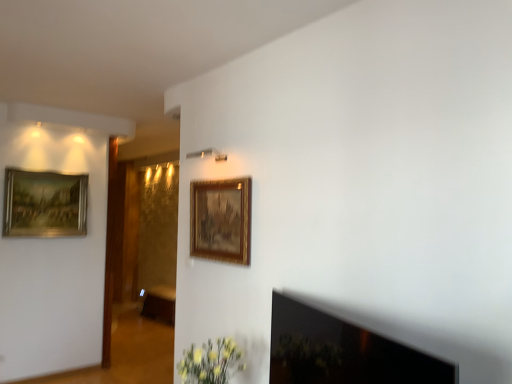
The image size is (512, 384). What do you see at coordinates (160, 304) in the screenshot? I see `brown wood cabinet at center` at bounding box center [160, 304].

I want to click on black glass fireplace at lower right, so click(343, 352).

The height and width of the screenshot is (384, 512). What do you see at coordinates (44, 204) in the screenshot?
I see `gold-framed painting at upper left, the second picture frame viewed from the front` at bounding box center [44, 204].

This screenshot has width=512, height=384. I want to click on brown wood cabinet at center, so click(160, 304).

Can you confirm if gold-framed painting at upper left, the 2th picture frame viewed from the right, is smaller than brown wood cabinet at center?

Indeed, gold-framed painting at upper left, the 2th picture frame viewed from the right, has a smaller size compared to brown wood cabinet at center.

In the scene shown: In the image, is gold-framed painting at upper left, the second picture frame viewed from the front, positioned in front of or behind brown wood cabinet at center?

gold-framed painting at upper left, the second picture frame viewed from the front, is positioned closer to the viewer than brown wood cabinet at center.

From a real-world perspective, which is physically below, gold-framed painting at upper left, which ranks as the first picture frame in back-to-front order, or brown wood cabinet at center?

From a 3D spatial view, brown wood cabinet at center is below.

Is gold-framed painting at upper left, which ranks as the first picture frame in back-to-front order, touching brown wood cabinet at center?

No, gold-framed painting at upper left, which ranks as the first picture frame in back-to-front order, is not with brown wood cabinet at center.

Locate an element on the screen. the 1st picture frame located above the black glass fireplace at lower right (from a real-world perspective) is located at coordinates (221, 220).

Is black glass fireplace at lower right turned away from gold/gilded picture frame at upper center, the second picture frame in the left-to-right sequence?

No, gold/gilded picture frame at upper center, the second picture frame in the left-to-right sequence, is not at the back of black glass fireplace at lower right.

Which is farther from the camera, (272, 343) or (219, 254)?

Point (219, 254)

In the image, is black glass fireplace at lower right positioned in front of or behind gold/gilded picture frame at upper center, which appears as the first picture frame when viewed from the right?

black glass fireplace at lower right is in front of gold/gilded picture frame at upper center, which appears as the first picture frame when viewed from the right.

From a real-world perspective, which object rests below the other?

From a 3D spatial view, brown wood cabinet at center is below.

Looking at this image, which is behind, gold/gilded picture frame at upper center, the 2th picture frame from the back, or brown wood cabinet at center?

brown wood cabinet at center is more distant.

Which object is further away from the camera, black glass fireplace at lower right or gold-framed painting at upper left, which ranks as the first picture frame in back-to-front order?

gold-framed painting at upper left, which ranks as the first picture frame in back-to-front order, is further from the camera.

Is black glass fireplace at lower right in contact with gold-framed painting at upper left, which is the 1th picture frame in left-to-right order?

black glass fireplace at lower right and gold-framed painting at upper left, which is the 1th picture frame in left-to-right order, are not in contact.

In terms of height, does black glass fireplace at lower right look taller or shorter compared to gold-framed painting at upper left, which is the 1th picture frame in left-to-right order?

In the image, black glass fireplace at lower right appears to be shorter than gold-framed painting at upper left, which is the 1th picture frame in left-to-right order.

Does point (371, 381) appear closer or farther from the camera than point (34, 199)?

Clearly, point (371, 381) is closer to the camera than point (34, 199).

How many degrees apart are the facing directions of black glass fireplace at lower right and brown wood cabinet at center?

18.9 degrees.

Which is in front, black glass fireplace at lower right or brown wood cabinet at center?

black glass fireplace at lower right is closer to the camera.

From the image's perspective, is black glass fireplace at lower right located beneath brown wood cabinet at center?

No, from the image's perspective, black glass fireplace at lower right is not beneath brown wood cabinet at center.

Is black glass fireplace at lower right next to brown wood cabinet at center?

No, black glass fireplace at lower right is not making contact with brown wood cabinet at center.

Which is more to the left, brown wood cabinet at center or black glass fireplace at lower right?

Positioned to the left is brown wood cabinet at center.

From the image's perspective, which is below, brown wood cabinet at center or black glass fireplace at lower right?

From the image's view, brown wood cabinet at center is below.

From a real-world perspective, which object stands above the other?

black glass fireplace at lower right is physically above.

From the image's perspective, which one is positioned lower, brown wood cabinet at center or gold-framed painting at upper left, which is the 1th picture frame in left-to-right order?

From the image's view, brown wood cabinet at center is below.

Is brown wood cabinet at center to the left or to the right of gold-framed painting at upper left, which is the 1th picture frame in left-to-right order, in the image?

In the image, brown wood cabinet at center appears on the right side of gold-framed painting at upper left, which is the 1th picture frame in left-to-right order.

From a real-world perspective, is brown wood cabinet at center positioned above or below gold-framed painting at upper left, the 2th picture frame viewed from the right?

In terms of real-world spatial position, brown wood cabinet at center is below gold-framed painting at upper left, the 2th picture frame viewed from the right.

At what (x,y) coordinates should I click in order to perform the action: click on furniture that appears below the gold-framed painting at upper left, which is the 1th picture frame in left-to-right order (from a real-world perspective). Please return your answer as a coordinate pair (x, y). This screenshot has width=512, height=384. Looking at the image, I should click on (160, 304).

The width and height of the screenshot is (512, 384). I want to click on fireplace on the right of the gold/gilded picture frame at upper center, placed as the first picture frame when sorted from front to back, so click(x=343, y=352).

Which object lies further to the anchor point gold/gilded picture frame at upper center, the second picture frame in the left-to-right sequence, brown wood cabinet at center or gold-framed painting at upper left, the second picture frame viewed from the front?

The object further to gold/gilded picture frame at upper center, the second picture frame in the left-to-right sequence, is brown wood cabinet at center.

Estimate the real-world distances between objects in this image. Which object is further from gold-framed painting at upper left, the second picture frame viewed from the front, black glass fireplace at lower right or gold/gilded picture frame at upper center, the 2th picture frame from the back?

black glass fireplace at lower right.

Considering their positions, is black glass fireplace at lower right positioned closer to gold/gilded picture frame at upper center, which appears as the first picture frame when viewed from the right, than brown wood cabinet at center?

black glass fireplace at lower right.

Looking at the image, which one is located closer to brown wood cabinet at center, black glass fireplace at lower right or gold/gilded picture frame at upper center, which appears as the first picture frame when viewed from the right?

gold/gilded picture frame at upper center, which appears as the first picture frame when viewed from the right, is closer to brown wood cabinet at center.

Considering their positions, is black glass fireplace at lower right positioned closer to gold-framed painting at upper left, the 2th picture frame viewed from the right, than brown wood cabinet at center?

brown wood cabinet at center.

Which object lies further to the anchor point black glass fireplace at lower right, brown wood cabinet at center or gold/gilded picture frame at upper center, the 2th picture frame from the back?

brown wood cabinet at center is positioned further to the anchor black glass fireplace at lower right.

Which object lies nearer to the anchor point brown wood cabinet at center, gold-framed painting at upper left, the second picture frame viewed from the front, or black glass fireplace at lower right?

Among the two, gold-framed painting at upper left, the second picture frame viewed from the front, is located nearer to brown wood cabinet at center.

Estimate the real-world distances between objects in this image. Which object is closer to gold/gilded picture frame at upper center, placed as the first picture frame when sorted from front to back, black glass fireplace at lower right or gold-framed painting at upper left, the second picture frame viewed from the front?

black glass fireplace at lower right.

Where is `picture frame positioned between gold/gilded picture frame at upper center, the 2th picture frame from the back, and brown wood cabinet at center from near to far`? Image resolution: width=512 pixels, height=384 pixels. picture frame positioned between gold/gilded picture frame at upper center, the 2th picture frame from the back, and brown wood cabinet at center from near to far is located at coordinates (44, 204).

Locate an element on the screen. The height and width of the screenshot is (384, 512). picture frame located between black glass fireplace at lower right and gold-framed painting at upper left, the second picture frame viewed from the front, in the depth direction is located at coordinates (221, 220).